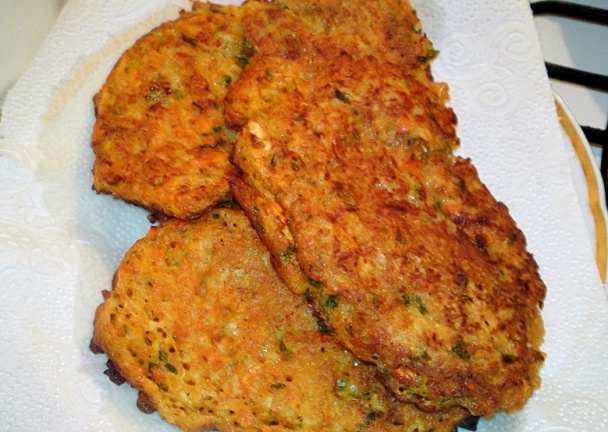
Where is `white paper towel with grease on it`? The width and height of the screenshot is (608, 432). white paper towel with grease on it is located at coordinates (111, 270).